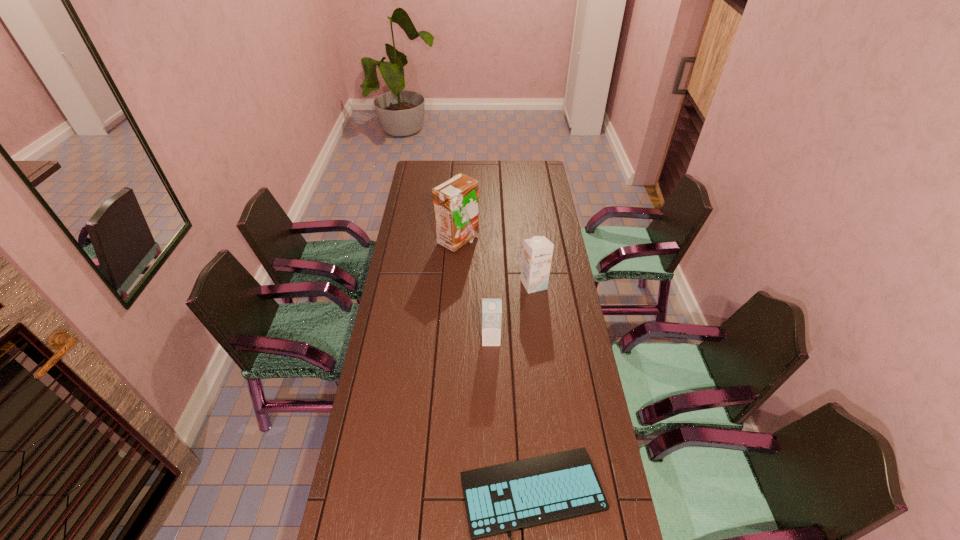
Where is `free space between the third farthest object and the farthest carton`? free space between the third farthest object and the farthest carton is located at coordinates (474, 290).

The height and width of the screenshot is (540, 960). In order to click on the third closest object to the third nearest object in this screenshot , I will do `click(499, 499)`.

Find the location of a particular element. This screenshot has height=540, width=960. object that is the closest to the second nearest carton is located at coordinates (455, 201).

I want to click on carton that is the closest to the second carton from right to left, so click(537, 251).

The height and width of the screenshot is (540, 960). I want to click on the second closest carton to the nearest carton, so click(455, 201).

Identify the location of free space that satisfies the following two spatial constraints: 1. on the straw side of the farthest object; 2. on the right side of the second nearest carton. This screenshot has width=960, height=540. (455, 285).

Image resolution: width=960 pixels, height=540 pixels. Find the location of `vacant space that satisfies the following two spatial constraints: 1. on the straw side of the second farthest carton; 2. on the right side of the tallest carton`. vacant space that satisfies the following two spatial constraints: 1. on the straw side of the second farthest carton; 2. on the right side of the tallest carton is located at coordinates (455, 285).

Image resolution: width=960 pixels, height=540 pixels. Identify the location of free space that satisfies the following two spatial constraints: 1. on the straw side of the tallest object; 2. on the left side of the second nearest carton. (455, 285).

Identify the location of free space that satisfies the following two spatial constraints: 1. on the back side of the third nearest object; 2. on the straw side of the leftmost carton. The width and height of the screenshot is (960, 540). (528, 241).